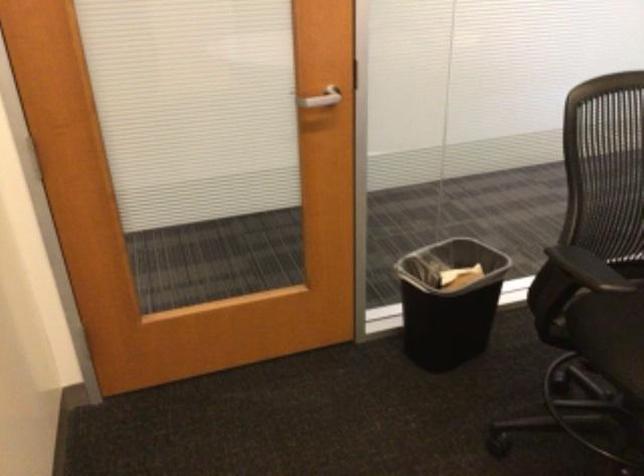
The image size is (644, 476). What do you see at coordinates (610, 335) in the screenshot?
I see `the chair sitting surface` at bounding box center [610, 335].